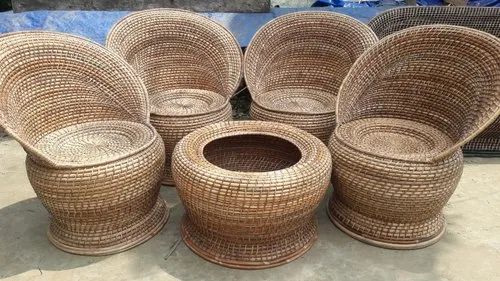
Identify the location of base of leftmost chair. The height and width of the screenshot is (281, 500). (114, 235).